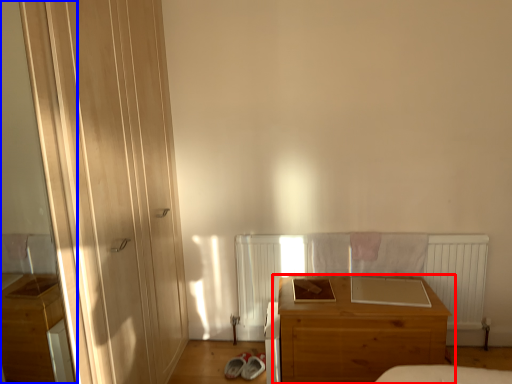
Question: Which of the following is the farthest to the observer, chest of drawers (highlighted by a red box) or screen door (highlighted by a blue box)?

Choices:
 (A) chest of drawers
 (B) screen door

Answer: (A)